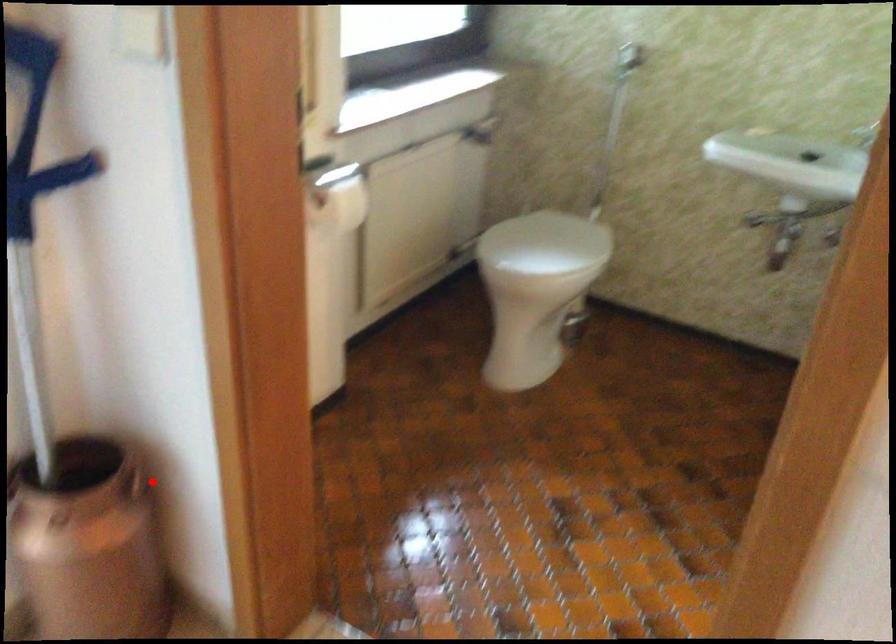
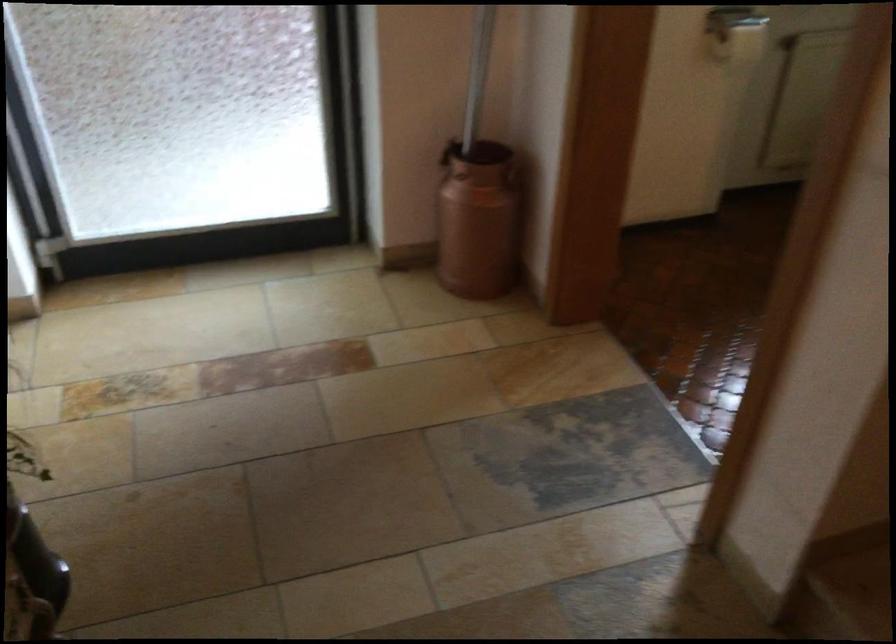
In the second image, find the point that corresponds to the highlighted location in the first image.

(513, 176)